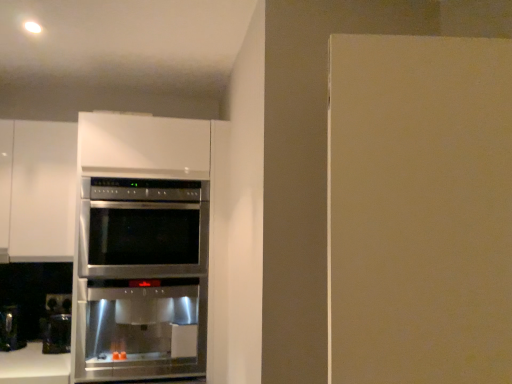
The height and width of the screenshot is (384, 512). Describe the element at coordinates (56, 324) in the screenshot. I see `black glossy coffee machine at lower left` at that location.

Find the location of `black glossy coffee machine at lower left`. black glossy coffee machine at lower left is located at coordinates (56, 324).

What is the approximate height of black glossy coffee machine at lower left?

black glossy coffee machine at lower left is 23.65 centimeters in height.

The width and height of the screenshot is (512, 384). What do you see at coordinates (142, 279) in the screenshot? I see `stainless steel oven at center` at bounding box center [142, 279].

At what (x,y) coordinates should I click in order to perform the action: click on stainless steel oven at center. Please return your answer as a coordinate pair (x, y). The image size is (512, 384). Looking at the image, I should click on (142, 279).

Find the location of a particular element. black glossy coffee machine at lower left is located at coordinates (56, 324).

Consider the image. Which object is positioned more to the left, stainless steel oven at center or black glossy coffee machine at lower left?

From the viewer's perspective, black glossy coffee machine at lower left appears more on the left side.

Which is in front, stainless steel oven at center or black glossy coffee machine at lower left?

stainless steel oven at center is more forward.

Is point (106, 264) closer or farther from the camera than point (55, 302)?

Point (106, 264) is closer to the camera than point (55, 302).

From the image's perspective, is stainless steel oven at center on top of black glossy coffee machine at lower left?

Yes, from the image's perspective, stainless steel oven at center is above black glossy coffee machine at lower left.

From a real-world perspective, is stainless steel oven at center positioned under black glossy coffee machine at lower left based on gravity?

Incorrect, from a real-world perspective, stainless steel oven at center is higher than black glossy coffee machine at lower left.

Between stainless steel oven at center and black glossy coffee machine at lower left, which one has larger width?

stainless steel oven at center is wider.

Consider the image. Between stainless steel oven at center and black glossy coffee machine at lower left, which one has more height?

With more height is stainless steel oven at center.

Which of these two, stainless steel oven at center or black glossy coffee machine at lower left, is bigger?

stainless steel oven at center.

Is stainless steel oven at center surrounding black glossy coffee machine at lower left?

That's incorrect, black glossy coffee machine at lower left is not inside stainless steel oven at center.

Is the surface of stainless steel oven at center in direct contact with black glossy coffee machine at lower left?

They are not placed beside each other.

Is stainless steel oven at center facing away from black glossy coffee machine at lower left?

No, stainless steel oven at center is not facing the opposite direction of black glossy coffee machine at lower left.

At what (x,y) coordinates should I click in order to perform the action: click on oven above the black glossy coffee machine at lower left (from the image's perspective). Please return your answer as a coordinate pair (x, y). Looking at the image, I should click on (142, 279).

In the image, is black glossy coffee machine at lower left on the left side or the right side of stainless steel oven at center?

Based on their positions, black glossy coffee machine at lower left is located to the left of stainless steel oven at center.

Which object is closer to the camera taking this photo, black glossy coffee machine at lower left or stainless steel oven at center?

Positioned in front is stainless steel oven at center.

Considering the positions of point (48, 349) and point (141, 313), is point (48, 349) closer or farther from the camera than point (141, 313)?

Clearly, point (48, 349) is more distant from the camera than point (141, 313).

From the image's perspective, which one is positioned higher, black glossy coffee machine at lower left or stainless steel oven at center?

stainless steel oven at center, from the image's perspective.

From a real-world perspective, is black glossy coffee machine at lower left positioned above or below stainless steel oven at center?

Clearly, from a real-world perspective, black glossy coffee machine at lower left is below stainless steel oven at center.

Is black glossy coffee machine at lower left wider than stainless steel oven at center?

Incorrect, the width of black glossy coffee machine at lower left does not surpass that of stainless steel oven at center.

Between black glossy coffee machine at lower left and stainless steel oven at center, which one has more height?

stainless steel oven at center is taller.

Looking at the image, does black glossy coffee machine at lower left seem bigger or smaller compared to stainless steel oven at center?

Clearly, black glossy coffee machine at lower left is smaller in size than stainless steel oven at center.

Is stainless steel oven at center located within black glossy coffee machine at lower left?

No, stainless steel oven at center is not a part of black glossy coffee machine at lower left.

Can you see black glossy coffee machine at lower left touching stainless steel oven at center?

No, black glossy coffee machine at lower left is not beside stainless steel oven at center.

Could you tell me if black glossy coffee machine at lower left is facing stainless steel oven at center?

No, black glossy coffee machine at lower left does not turn towards stainless steel oven at center.

What's the angular difference between black glossy coffee machine at lower left and stainless steel oven at center's facing directions?

0.00139 degrees separate the facing orientations of black glossy coffee machine at lower left and stainless steel oven at center.

Measure the distance from black glossy coffee machine at lower left to stainless steel oven at center.

The distance of black glossy coffee machine at lower left from stainless steel oven at center is 25.11 inches.

The image size is (512, 384). I want to click on coffee machine behind the stainless steel oven at center, so click(x=56, y=324).

Find the location of a particular element. The image size is (512, 384). coffee machine on the left of stainless steel oven at center is located at coordinates (56, 324).

Image resolution: width=512 pixels, height=384 pixels. I want to click on oven located in front of the black glossy coffee machine at lower left, so click(x=142, y=279).